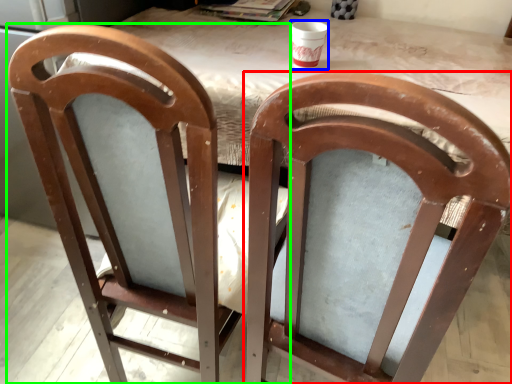
Question: Which object is positioned closest to chair (highlighted by a red box)? Select from cup (highlighted by a blue box) and chair (highlighted by a green box).

Choices:
 (A) cup
 (B) chair

Answer: (B)